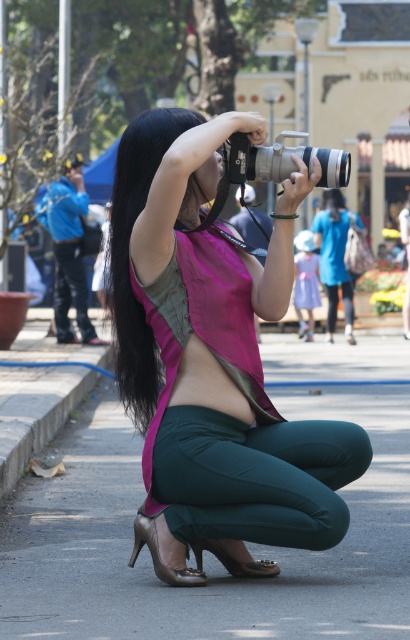
Question: Is pink matte vest at center wider than blue denim jeans at center?

Choices:
 (A) no
 (B) yes

Answer: (B)

Question: Which of the following is the closest to the observer?

Choices:
 (A) (287, 163)
 (B) (141, 385)
 (C) (323, 250)

Answer: (A)

Question: Which object appears closest to the camera in this image?

Choices:
 (A) pink fabric bikini top at center
 (B) pink matte vest at center

Answer: (B)

Question: Does black silky hair at center have a lesser width compared to blue denim jeans at center?

Choices:
 (A) yes
 (B) no

Answer: (A)

Question: Which point is closer to the camera?

Choices:
 (A) (77, 323)
 (B) (188, 312)
 (C) (191, 385)
 (D) (27, 337)

Answer: (C)

Question: In this image, where is matte silver camera at center located relative to skinny green pants at center?

Choices:
 (A) right
 (B) left

Answer: (A)